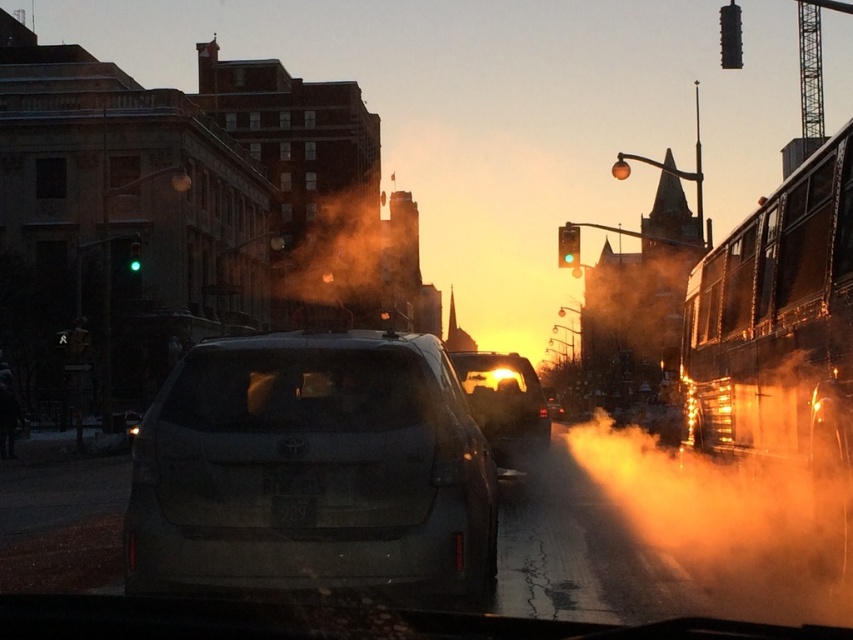
Question: Does black matte license plate at center come in front of metallic traffic light at upper right?

Choices:
 (A) yes
 (B) no

Answer: (A)

Question: Can you confirm if orange foggy steam at center is positioned above black matte license plate at center?

Choices:
 (A) yes
 (B) no

Answer: (A)

Question: Which point is closer to the camera?

Choices:
 (A) click(476, 442)
 (B) click(299, 502)
 (C) click(560, 244)
 (D) click(315, 273)

Answer: (B)

Question: Is matte gray suv at center positioned in front of green glass traffic light at left?

Choices:
 (A) no
 (B) yes

Answer: (B)

Question: Which of the following is the farthest from the observer?

Choices:
 (A) (344, 266)
 (B) (138, 264)
 (C) (525, 451)

Answer: (A)

Question: Which point is farther from the camera taking this photo?

Choices:
 (A) (537, 410)
 (B) (288, 321)
 (C) (281, 520)

Answer: (B)